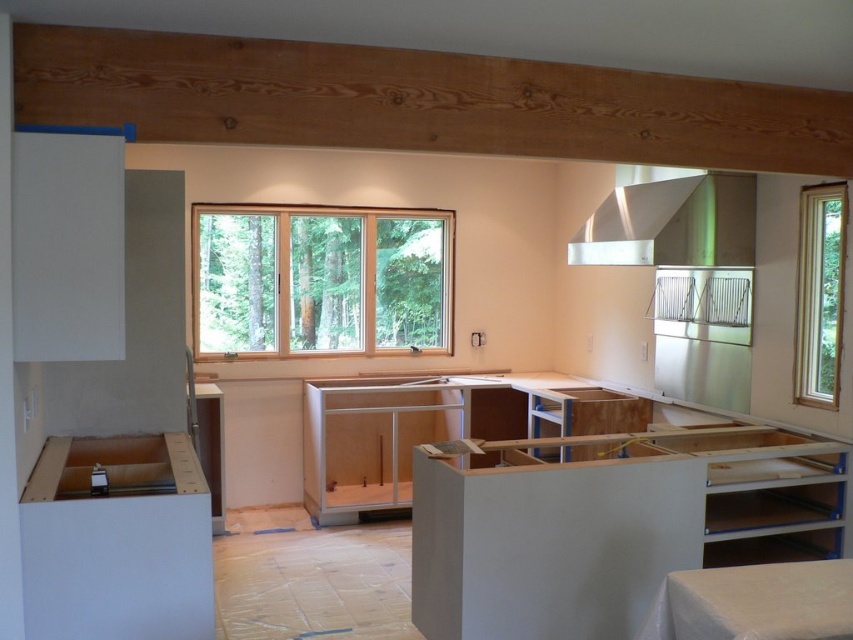
Is natural wood beam at upper center smaller than satin silver exhaust hood at upper right?

No, natural wood beam at upper center is not smaller than satin silver exhaust hood at upper right.

From the picture: Is natural wood beam at upper center behind satin silver exhaust hood at upper right?

No.

The height and width of the screenshot is (640, 853). Identify the location of natural wood beam at upper center. pos(416,100).

Between natural wood beam at upper center and clear glass window at right, which one is positioned higher?

natural wood beam at upper center

Who is positioned more to the right, natural wood beam at upper center or clear glass window at right?

clear glass window at right is more to the right.

Who is more forward, (256, 100) or (833, 332)?

Point (256, 100) is more forward.

The image size is (853, 640). In order to click on natural wood beam at upper center in this screenshot , I will do click(416, 100).

Does clear glass window at center appear under satin silver exhaust hood at upper right?

Indeed, clear glass window at center is positioned under satin silver exhaust hood at upper right.

Between clear glass window at center and satin silver exhaust hood at upper right, which one is positioned lower?

Positioned lower is clear glass window at center.

Is point (398, 273) positioned in front of point (654, 250)?

That is False.

Locate an element on the screen. clear glass window at center is located at coordinates (320, 280).